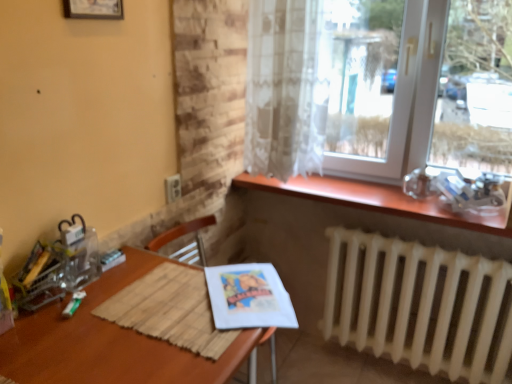
Question: Relative to brown wooden table at center, is white matte radiator at lower right in front or behind?

Choices:
 (A) front
 (B) behind

Answer: (B)

Question: Is point (460, 354) positioned closer to the camera than point (128, 258)?

Choices:
 (A) farther
 (B) closer

Answer: (A)

Question: Which is farther from the wooden at upper right?

Choices:
 (A) matte paper magazine at lower center
 (B) wooden picture frame at upper left
 (C) brown wooden table at center
 (D) white matte radiator at lower right
 (E) sheer white curtain at upper right

Answer: (B)

Question: Based on their relative distances, which object is farther from the matte paper magazine at lower center?

Choices:
 (A) wooden at upper right
 (B) sheer white curtain at upper right
 (C) wooden picture frame at upper left
 (D) transparent glass window at upper right
 (E) brown wooden table at center

Answer: (C)